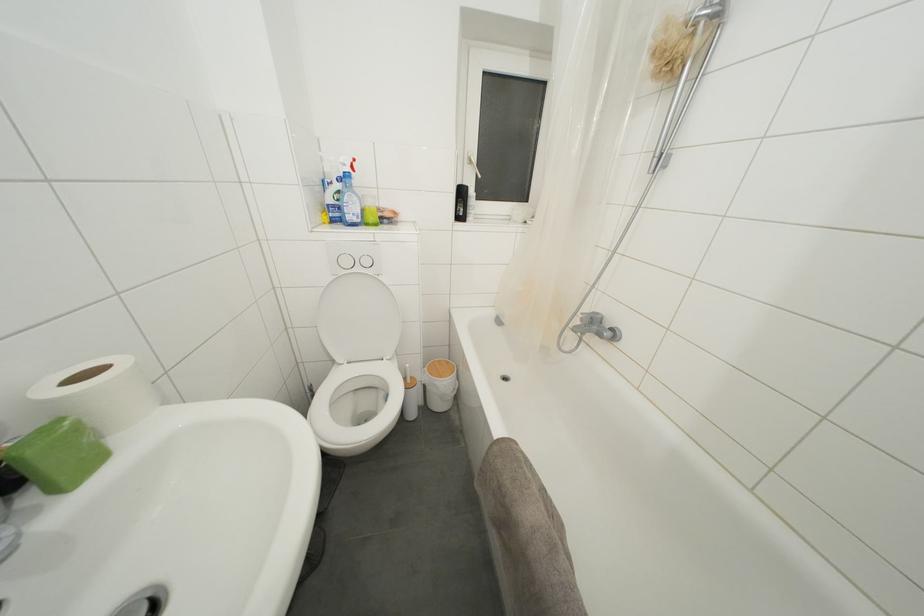
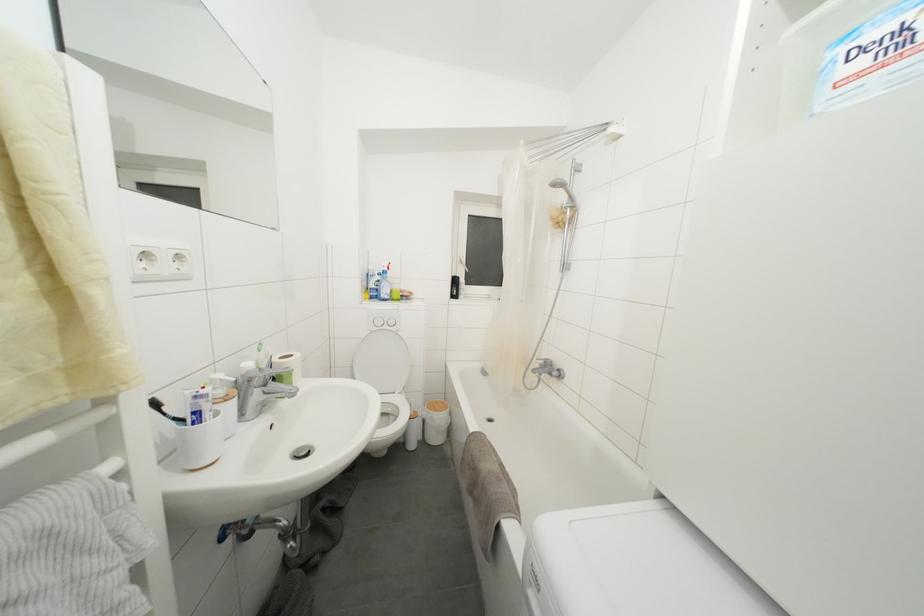
In the second image, find the point that corresponds to (x=341, y=221) in the first image.

(379, 300)